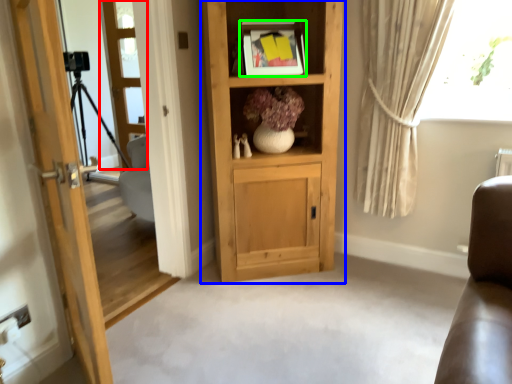
Question: Considering the real-world distances, which object is closest to screen door (highlighted by a red box)? cabinetry (highlighted by a blue box) or picture frame (highlighted by a green box).

Choices:
 (A) cabinetry
 (B) picture frame

Answer: (B)